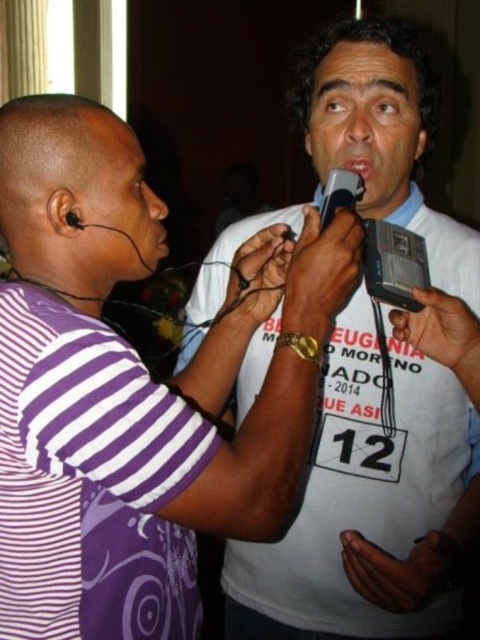
Can you confirm if white matte shirt at center is smaller than black plastic microphone at center?

Actually, white matte shirt at center might be larger than black plastic microphone at center.

Between white matte shirt at center and black plastic microphone at center, which one has less height?

Standing shorter between the two is black plastic microphone at center.

Is point (41, 497) positioned after point (360, 196)?

No.

I want to click on white matte shirt at center, so click(x=134, y=387).

Between point (397, 404) and point (330, 200), which one is positioned in front?

Point (330, 200)

Does point (448, 225) come behind point (323, 212)?

Yes.

Who is more distant from viewer, (395, 488) or (343, 204)?

Point (395, 488)

This screenshot has height=640, width=480. What are the coordinates of `white fabric shirt at center` in the screenshot? It's located at (369, 506).

Locate an element on the screen. The height and width of the screenshot is (640, 480). white matte shirt at center is located at coordinates (134, 387).

Who is more distant from viewer, (16, 596) or (465, 458)?

Point (465, 458)

Where is `white matte shirt at center`? white matte shirt at center is located at coordinates (134, 387).